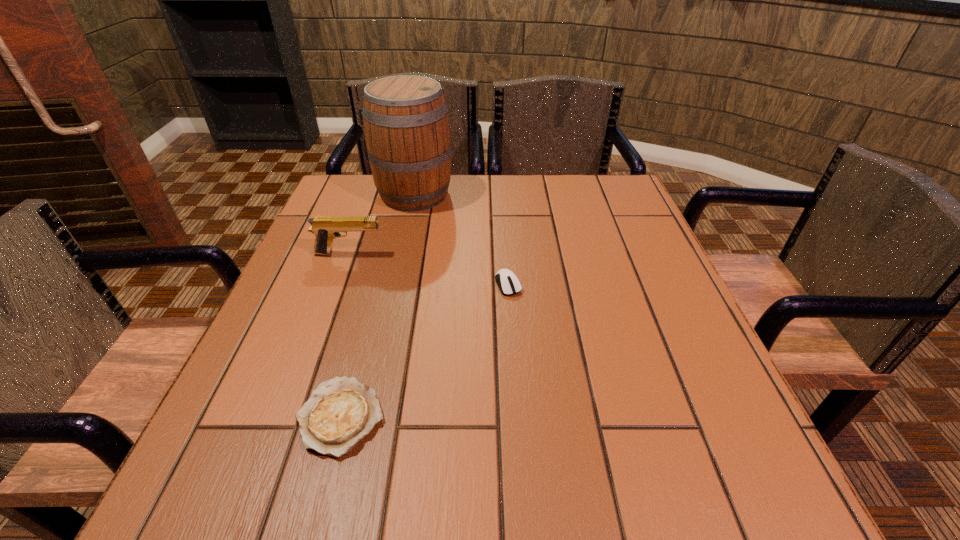
Locate an element on the screen. vacant space positioned on the front of the third farthest object is located at coordinates (516, 398).

Find the location of `vacant space located 0.160m on the back of the nearest object`. vacant space located 0.160m on the back of the nearest object is located at coordinates (369, 312).

Where is `object that is at the far edge`? This screenshot has height=540, width=960. object that is at the far edge is located at coordinates (406, 126).

This screenshot has width=960, height=540. Find the location of `object positioned at the near edge`. object positioned at the near edge is located at coordinates (341, 412).

Identify the location of cider positioned at the left edge. (406, 126).

Locate an element on the screen. pistol positioned at the left edge is located at coordinates (326, 228).

At what (x,y) coordinates should I click in order to perform the action: click on quiche at the left edge. Please return your answer as a coordinate pair (x, y). The image size is (960, 540). Looking at the image, I should click on (341, 412).

This screenshot has width=960, height=540. Identify the location of object situated at the far left corner. (406, 126).

What are the coordinates of `object located in the near left corner section of the desktop` in the screenshot? It's located at (341, 412).

The width and height of the screenshot is (960, 540). What are the coordinates of `free region at the far edge` in the screenshot? It's located at (481, 206).